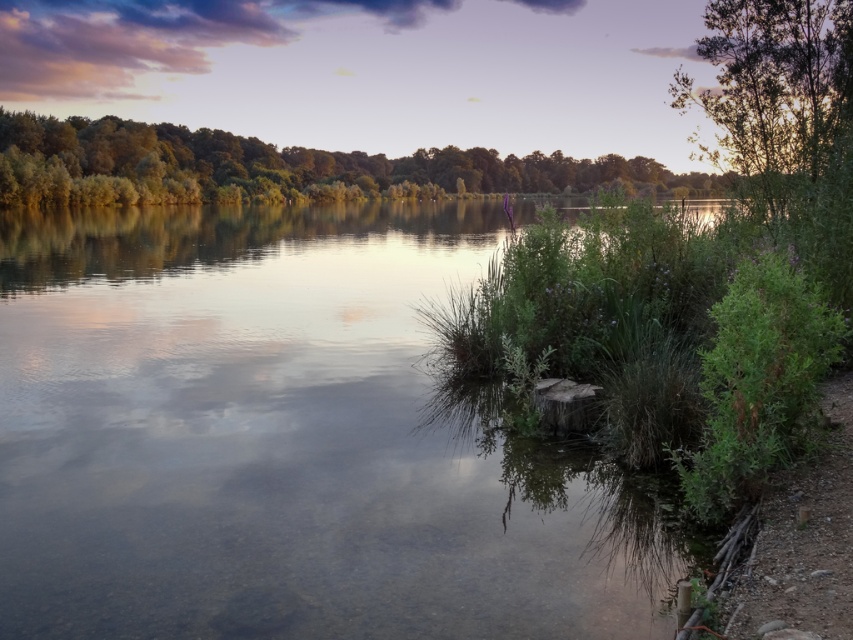
Question: Which object appears farthest from the camera in this image?

Choices:
 (A) green leafy trees at upper left
 (B) clear water at center

Answer: (A)

Question: Is clear water at center bigger than green leafy tree at upper right?

Choices:
 (A) yes
 (B) no

Answer: (A)

Question: Which object is farther from the camera taking this photo?

Choices:
 (A) green leafy tree at upper right
 (B) green leafy trees at upper left
 (C) clear water at center

Answer: (B)

Question: Among these points, which one is nearest to the camera?

Choices:
 (A) (814, 138)
 (B) (24, 632)

Answer: (B)

Question: Can you confirm if clear water at center is positioned to the left of green leafy trees at upper left?

Choices:
 (A) yes
 (B) no

Answer: (A)

Question: Considering the relative positions of clear water at center and green leafy tree at upper right in the image provided, where is clear water at center located with respect to green leafy tree at upper right?

Choices:
 (A) left
 (B) right

Answer: (A)